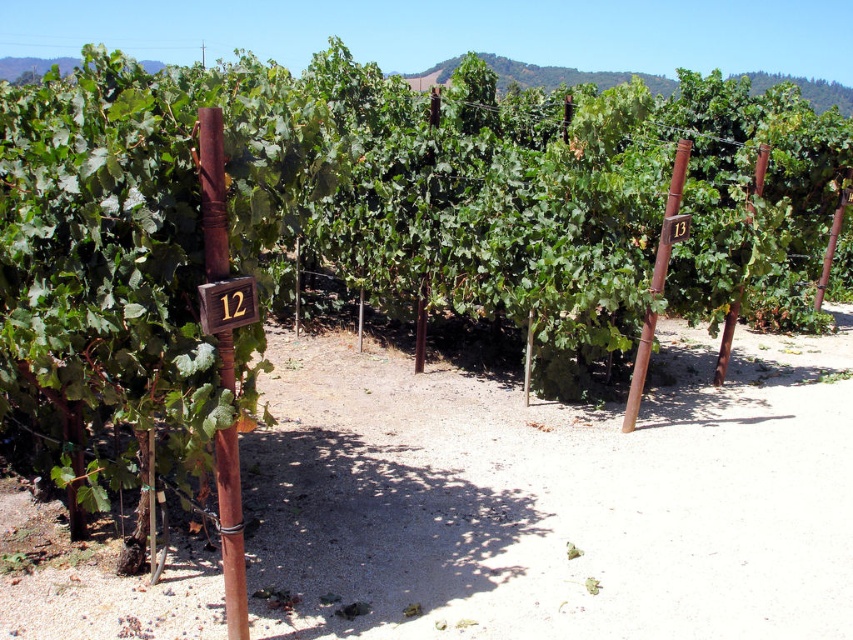
You are a vineyard worker checking the rows of grapevines. You see the rusty wood pole at center right and the rustic wood pole at right. Which pole is closer to the left side of the image?

The rusty wood pole at center right is positioned on the left side of rustic wood pole at right, so the rusty wood pole at center right is closer to the left side of the image.

You are a vineyard tour guide and need to direct visitors to the wooden sign at center. You see the rustic wood pole at right nearby. Which object is shorter?

The wooden sign at center is not as tall as the rustic wood pole at right, so the wooden sign at center is shorter.